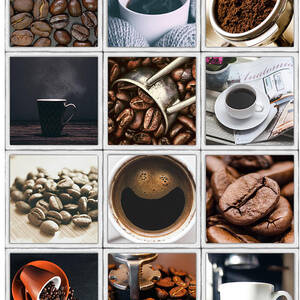
Find the location of a particular element. coffee cups in the collage is located at coordinates (39, 279), (243, 288), (237, 105), (51, 114), (152, 23), (256, 30).